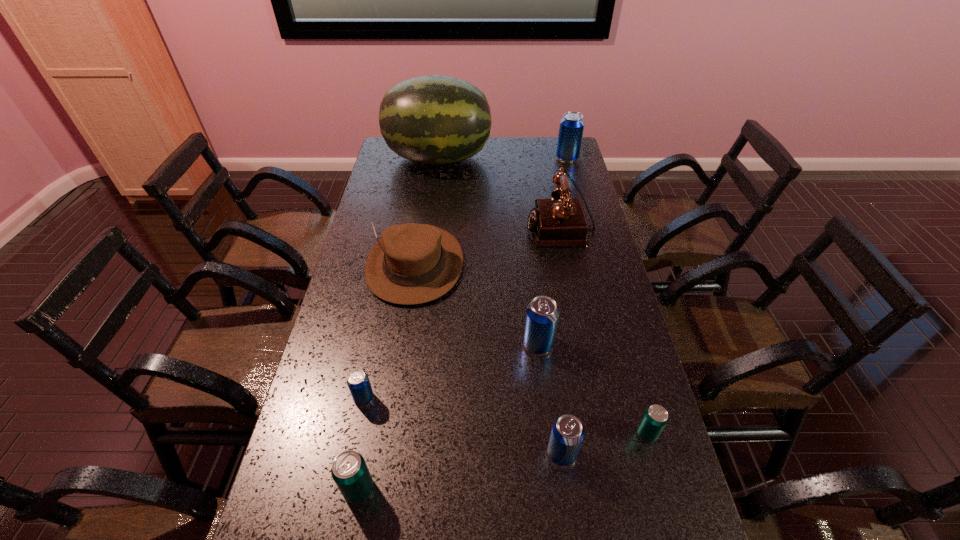
Where is `green watermelon`? green watermelon is located at coordinates (433, 119).

Where is `watermelon`? This screenshot has width=960, height=540. watermelon is located at coordinates (433, 119).

At what (x,y) coordinates should I click in order to perform the action: click on telephone. Please return your answer as a coordinate pair (x, y). The image size is (960, 540). Looking at the image, I should click on (556, 222).

In order to click on the farthest beer can in this screenshot , I will do `click(571, 128)`.

You are a GUI agent. You are given a task and a screenshot of the screen. Output one action in this format:
    pyautogui.click(x=<x>, y=<y>)
    Task: Click on the rightmost blue beer can
    Image resolution: width=960 pixels, height=540 pixels.
    Given the screenshot: What is the action you would take?
    pyautogui.click(x=571, y=128)

At what (x,y) coordinates should I click in order to perform the action: click on fedora. Please return your answer as a coordinate pair (x, y). Looking at the image, I should click on (411, 263).

The image size is (960, 540). Identify the location of the second tallest beer can. (542, 314).

Where is `the second farthest blue beer can`? the second farthest blue beer can is located at coordinates (542, 314).

The height and width of the screenshot is (540, 960). I want to click on the nearer teal beer can, so click(349, 470).

At what (x,y) coordinates should I click in order to perform the action: click on the left teal beer can. Please return your answer as a coordinate pair (x, y). This screenshot has width=960, height=540. Looking at the image, I should click on (349, 470).